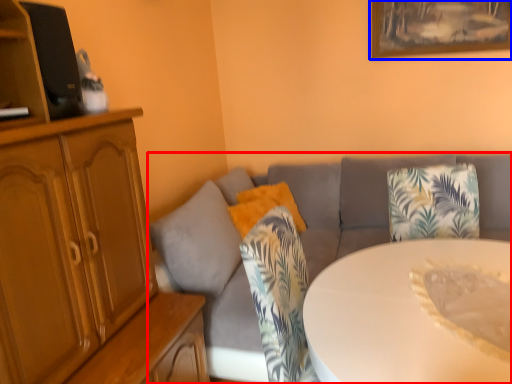
Question: Which point is further to the camera, studio couch (highlighted by a red box) or picture frame (highlighted by a blue box)?

Choices:
 (A) studio couch
 (B) picture frame

Answer: (B)